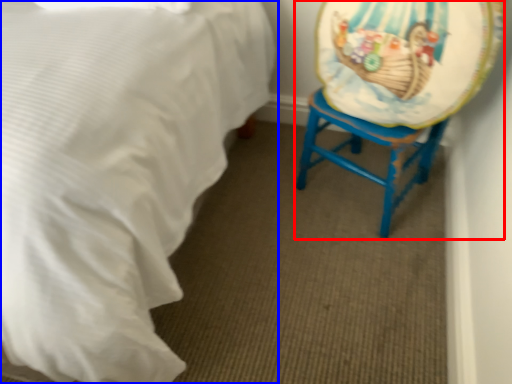
Question: Among these objects, which one is nearest to the camera, swivel chair (highlighted by a red box) or bed (highlighted by a blue box)?

Choices:
 (A) swivel chair
 (B) bed

Answer: (B)